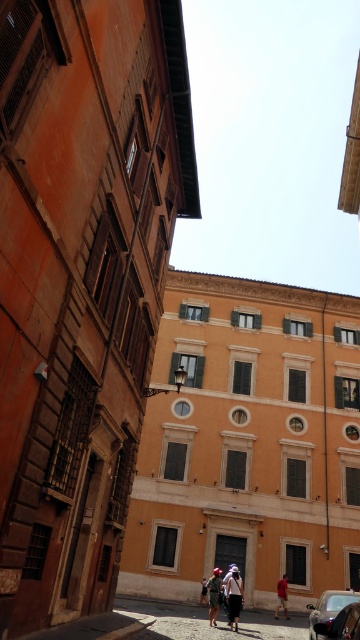
You are a delivery person who needs to park your shiny black car at center in a parking spot that is 3.5 meters wide. Can you fit your car into the spot without overlapping the brown leather jacket at center?

The shiny black car at center and brown leather jacket at center are 4.18 meters apart. Since the parking spot is 3.5 meters wide, the car cannot fit without overlapping the jacket as the distance between them exceeds the spot width.

You are a pedestrian standing on the street looking at the historic building. You see a shiny black car at center and a brown leather jacket at center. Which object is positioned higher from the ground?

The shiny black car at center is above the brown leather jacket at center, so the shiny black car at center is positioned higher from the ground.